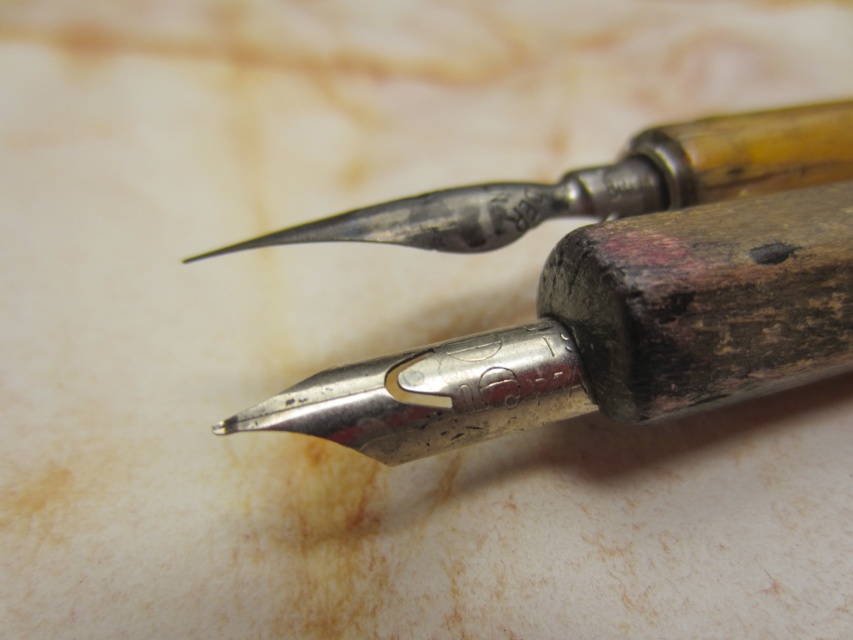
Question: Does polished metal pen at center come in front of polished silver pen at center?

Choices:
 (A) yes
 (B) no

Answer: (A)

Question: Does polished metal pen at center appear over polished silver pen at center?

Choices:
 (A) no
 (B) yes

Answer: (A)

Question: Which object appears farthest from the camera in this image?

Choices:
 (A) polished silver pen at center
 (B) polished metal pen at center

Answer: (A)

Question: Does polished metal pen at center appear over polished silver pen at center?

Choices:
 (A) yes
 (B) no

Answer: (B)

Question: Which point is farther to the camera?

Choices:
 (A) polished metal pen at center
 (B) polished silver pen at center

Answer: (B)